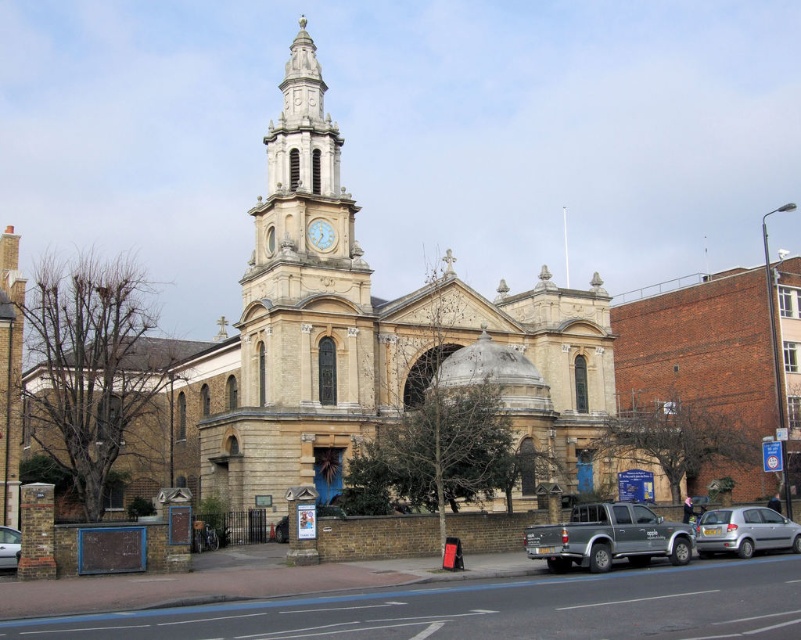
You are a visitor arriving at the historic church and need to park your car. You see a matte gray pickup truck at lower center and a silver metallic car at lower left. Which parking spot is available if the truck is blocking the entrance?

The silver metallic car at lower left is on the left side of the matte gray pickup truck at lower center, so the parking spot to the left of the truck might be available.

You are a visitor arriving at the church and see the silver metallic hatchback at lower right and the silver metallic car at lower left parked nearby. Which vehicle should you avoid parking next to if you want to leave first?

You should avoid parking next to the silver metallic hatchback at lower right because it is larger in size compared to the silver metallic car at lower left, which might block your exit if it leaves first.

You are a visitor trying to park your car in the parking lot near the historic church. You see a matte gray pickup truck at lower center and a silver metallic car at lower left. Which vehicle should you choose if you want to park in a tighter space?

The silver metallic car at lower left is smaller in size than the matte gray pickup truck at lower center, so it would be better to choose the silver metallic car at lower left for tighter parking spaces.